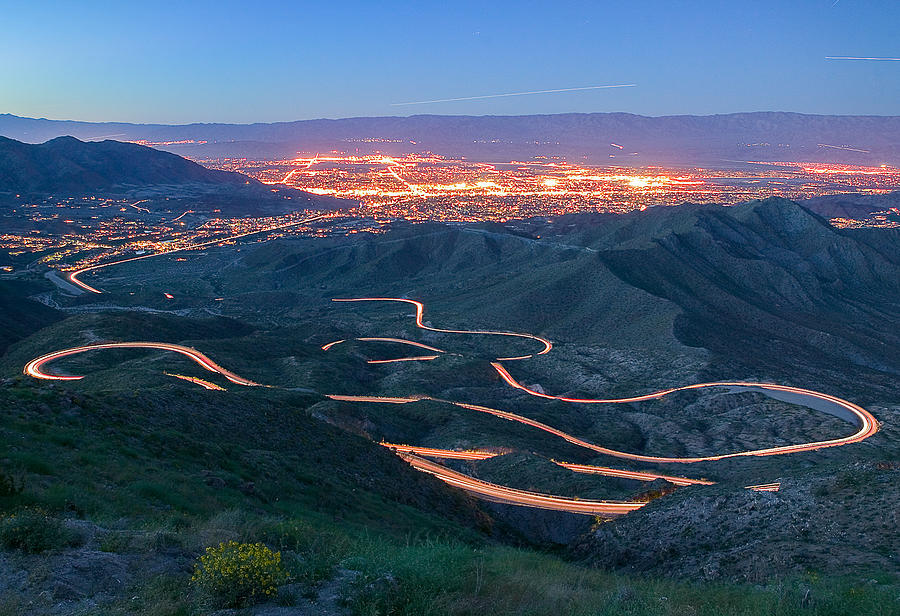
Identify the location of bright lights. The image size is (900, 616). (640, 182), (552, 180), (482, 182).